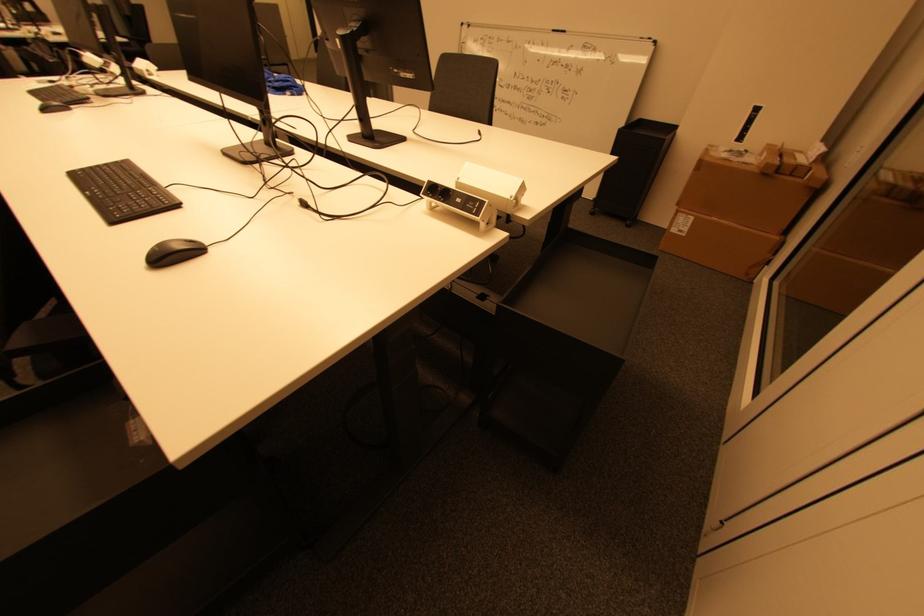
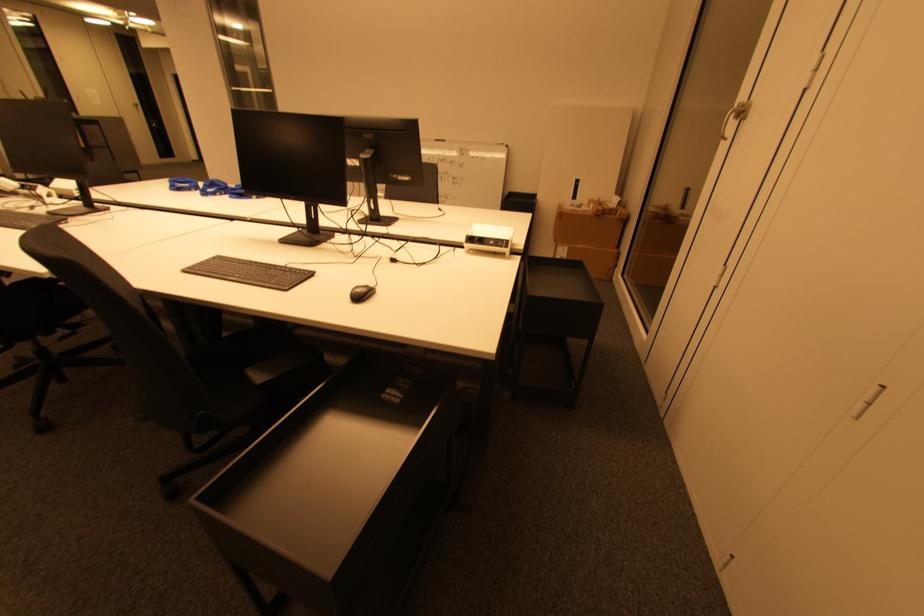
What movement of the cameraman would produce the second image?

The cameraman walked toward left, backward.